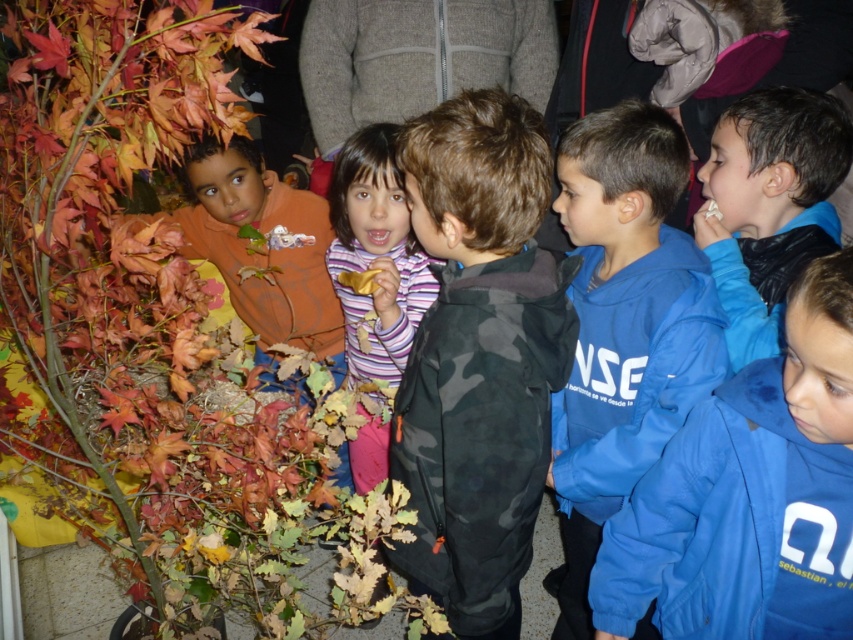
Question: Which point is closer to the camera?

Choices:
 (A) (831, 132)
 (B) (630, 145)
 (C) (492, 499)

Answer: (C)

Question: Which of these objects is positioned farthest from the blue fleece jacket at right?

Choices:
 (A) camouflage jacket at center
 (B) blue fleece sweatshirt at center
 (C) blue fabric jacket at right

Answer: (C)

Question: Can you confirm if blue fabric jacket at right is positioned below blue fleece sweatshirt at center?

Choices:
 (A) no
 (B) yes

Answer: (B)

Question: Which object is closer to the camera taking this photo?

Choices:
 (A) blue fleece sweatshirt at center
 (B) blue fabric jacket at right
 (C) camouflage jacket at center

Answer: (B)

Question: Can you confirm if camouflage jacket at center is positioned below blue fabric jacket at right?

Choices:
 (A) no
 (B) yes

Answer: (A)

Question: Is camouflage jacket at center bigger than blue fabric jacket at right?

Choices:
 (A) no
 (B) yes

Answer: (B)